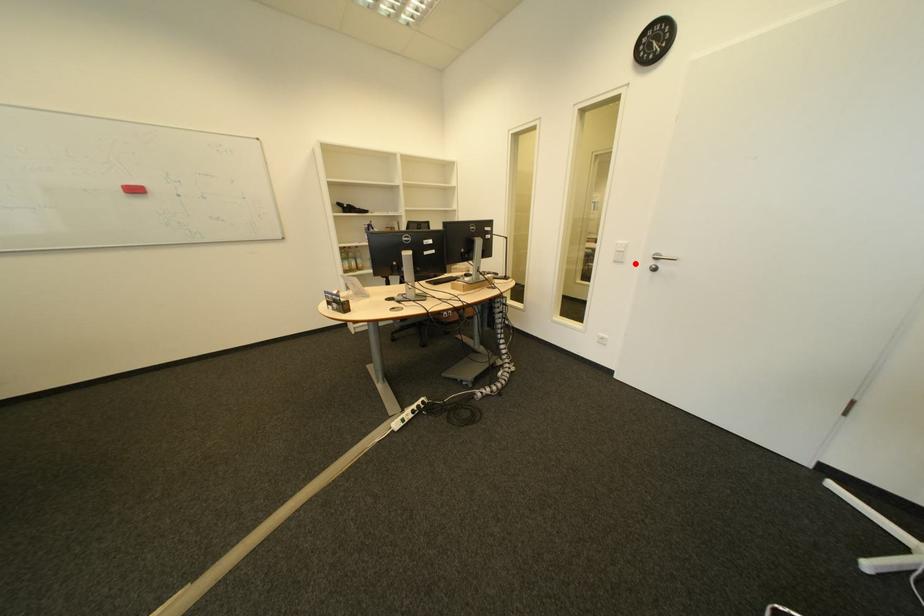
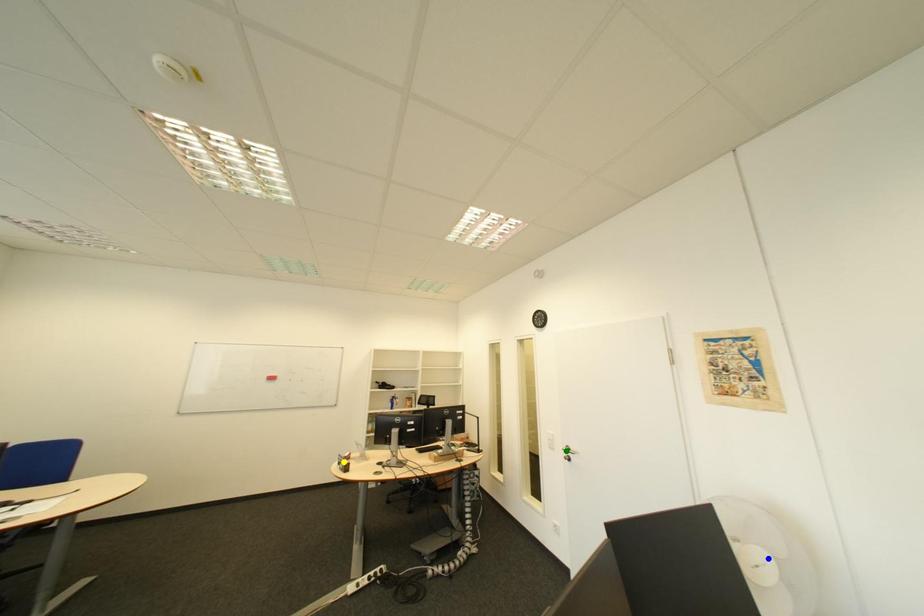
Question: I am providing you with two images of the same scene from different viewpoints. A red point is marked on the first image. You are given multiple points on the second image. Can you choose the point in image 2 that corresponds to the point in image 1?

Choices:
 (A) green point
 (B) yellow point
 (C) blue point

Answer: (A)